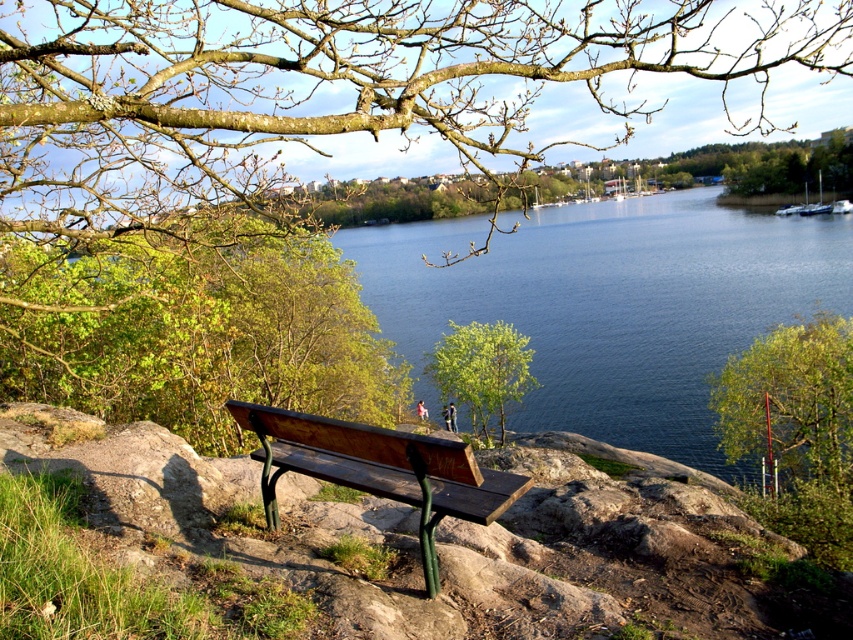
You are a photographer wanting to capture the wooden bench at center and the green leafy tree at center in a single frame. Which object should you position closer to the bottom of your camera viewfinder to include both in the composition?

The wooden bench at center is located below the green leafy tree at center, so to include both in the composition, you should position the wooden bench at center closer to the bottom of the camera viewfinder.

Consider the image. You are a bird looking for a nesting spot. You see two trees in the image, the green leafy tree at lower right and the green leafy tree at center. Which tree would be a better choice for nesting based on their sizes?

The green leafy tree at lower right is larger in size than the green leafy tree at center, making it a better choice for nesting due to its size.